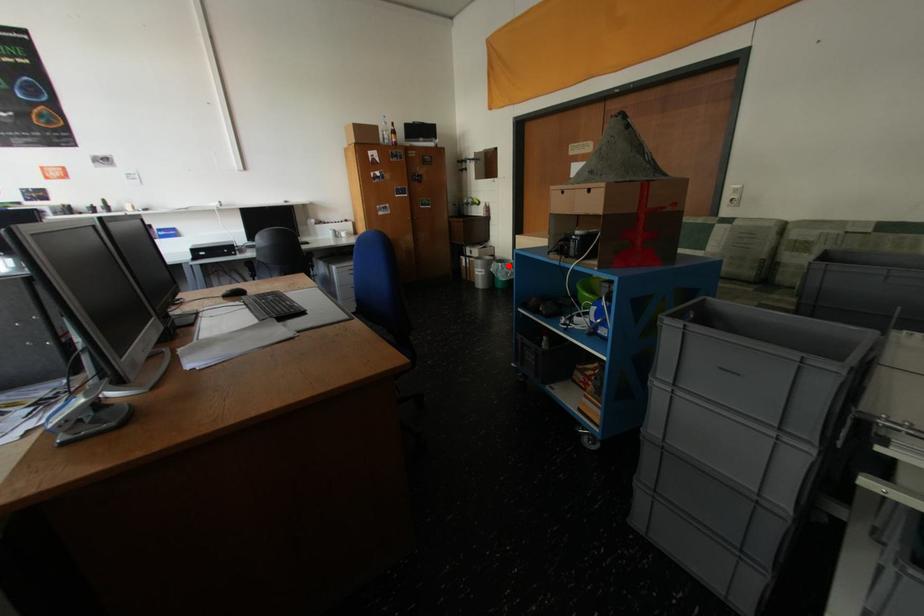
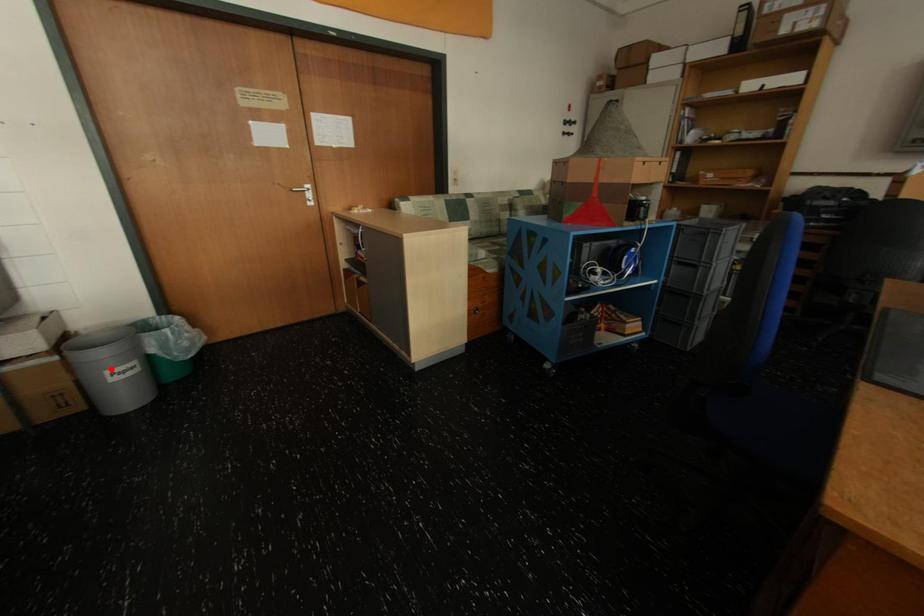
I am providing you with two images of the same scene from different viewpoints. A red point is marked on the first image and another point is marked on the second image. Are the points marked in image1 and image2 representing the same 3D position?

No